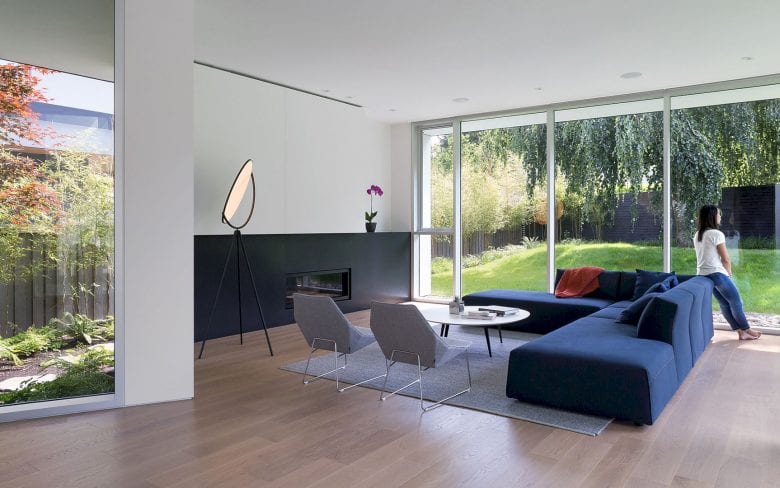
You are a GUI agent. You are given a task and a screenshot of the screen. Output one action in this format:
    pyautogui.click(x=<x>, y=<y>)
    Task: Click on the white walls
    
    Given the screenshot: What is the action you would take?
    coord(289,136), coord(161,197)